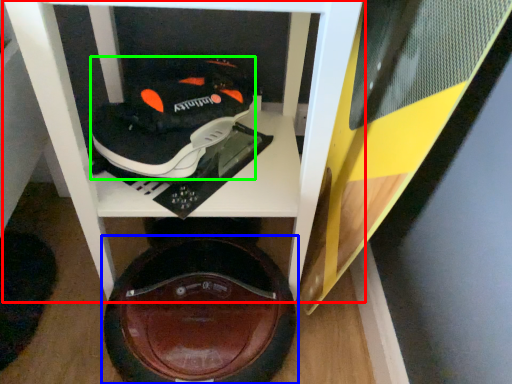
Question: Estimate the real-world distances between objects in this image. Which object is closer to furniture (highlighted by a red box), footwear (highlighted by a blue box) or shoe (highlighted by a green box)?

Choices:
 (A) footwear
 (B) shoe

Answer: (B)